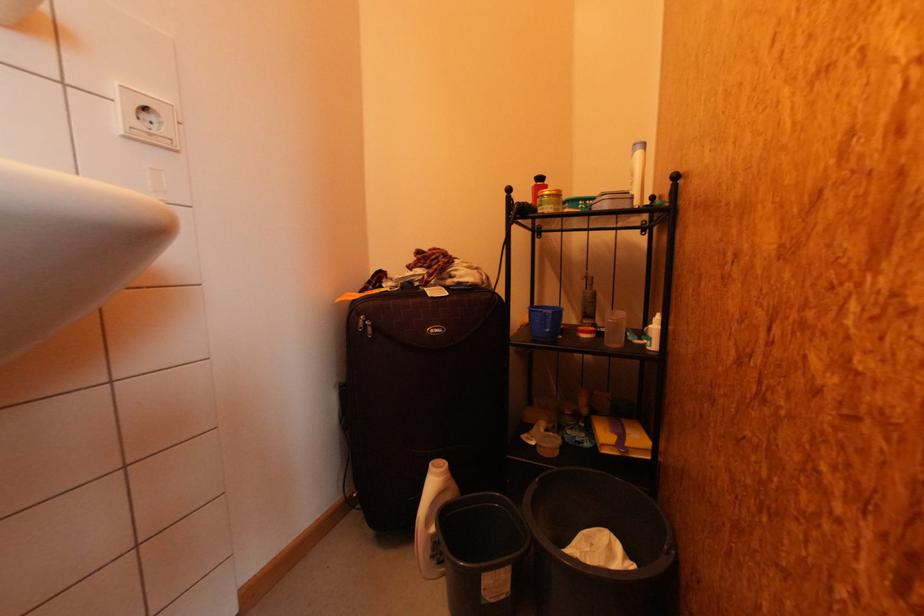
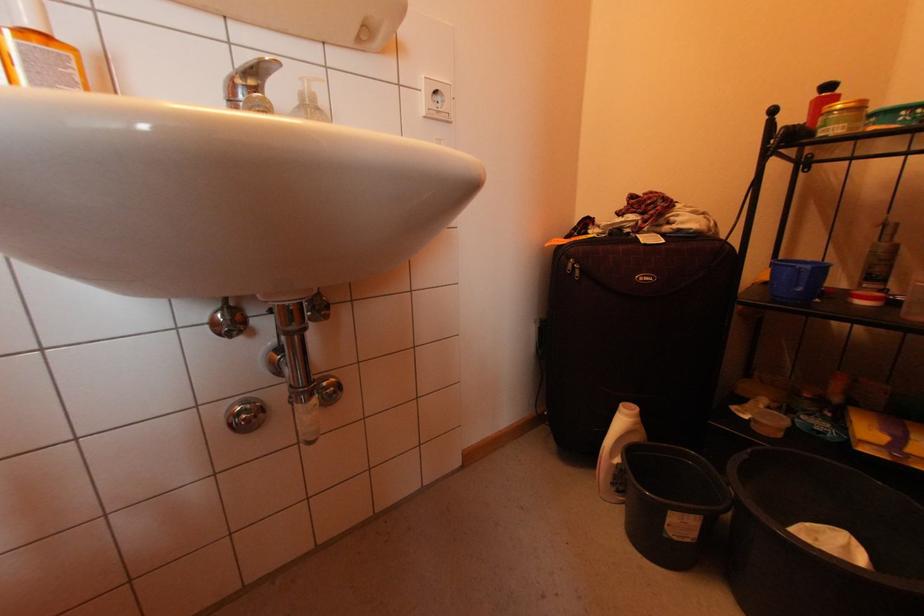
The point at (451, 483) is marked in the first image. Where is the corresponding point in the second image?

(640, 424)